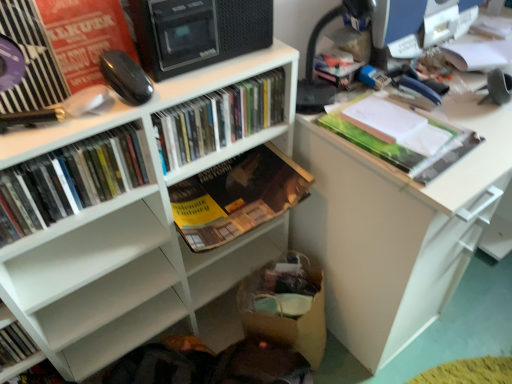
Question: From the image's perspective, is white matte bookcase at upper left above matte plastic books at center, which is counted as the 3th book, starting from the right?

Choices:
 (A) no
 (B) yes

Answer: (A)

Question: Is white matte bookcase at upper left wider than matte plastic books at center, placed as the third book when sorted from left to right?

Choices:
 (A) no
 (B) yes

Answer: (B)

Question: Is white matte bookcase at upper left beside matte plastic books at center, which is counted as the 3th book, starting from the right?

Choices:
 (A) no
 (B) yes

Answer: (A)

Question: Would you say white matte bookcase at upper left contains matte plastic books at center, placed as the third book when sorted from left to right?

Choices:
 (A) no
 (B) yes

Answer: (B)

Question: From a real-world perspective, is white matte bookcase at upper left located beneath matte plastic books at center, placed as the third book when sorted from left to right?

Choices:
 (A) no
 (B) yes

Answer: (B)

Question: Looking at their shapes, would you say black glossy mouse at upper left is wider or thinner than matte plastic books at center, which is counted as the 3th book, starting from the right?

Choices:
 (A) thin
 (B) wide

Answer: (A)

Question: Relative to matte plastic books at center, placed as the third book when sorted from left to right, is black glossy mouse at upper left in front or behind?

Choices:
 (A) front
 (B) behind

Answer: (A)

Question: Is point (117, 61) positioned closer to the camera than point (254, 94)?

Choices:
 (A) farther
 (B) closer

Answer: (B)

Question: From their relative heights in the image, would you say black glossy mouse at upper left is taller or shorter than matte plastic books at center, which is counted as the 3th book, starting from the right?

Choices:
 (A) short
 (B) tall

Answer: (A)

Question: In terms of width, does matte black monitor at upper right look wider or thinner when compared to green matte folder at upper right, the 5th book viewed from the left?

Choices:
 (A) wide
 (B) thin

Answer: (B)

Question: Is matte black monitor at upper right situated inside green matte folder at upper right, the 5th book viewed from the left, or outside?

Choices:
 (A) outside
 (B) inside

Answer: (A)

Question: From a real-world perspective, is matte black monitor at upper right physically located above or below green matte folder at upper right, the 1th book positioned from the right?

Choices:
 (A) below
 (B) above

Answer: (B)

Question: Does point (384, 57) appear closer or farther from the camera than point (353, 127)?

Choices:
 (A) farther
 (B) closer

Answer: (A)

Question: From the image's perspective, relative to white matte bookcase at upper left, is matte plastic books at left, positioned as the second book in left-to-right order, above or below?

Choices:
 (A) above
 (B) below

Answer: (A)

Question: Is matte plastic books at left, positioned as the second book in left-to-right order, bigger or smaller than white matte bookcase at upper left?

Choices:
 (A) small
 (B) big

Answer: (A)